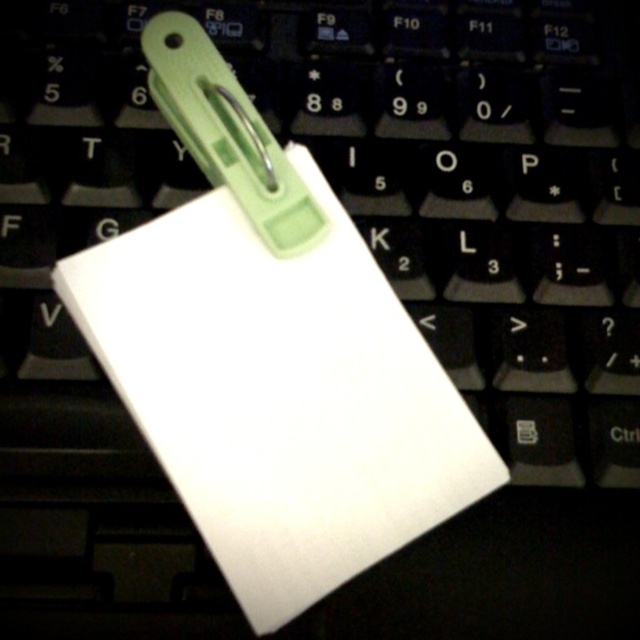
Question: Considering the relative positions of white matte notepad at center and green plastic clip at center in the image provided, where is white matte notepad at center located with respect to green plastic clip at center?

Choices:
 (A) right
 (B) left

Answer: (A)

Question: Which point appears closest to the camera in this image?

Choices:
 (A) (196, 113)
 (B) (52, 285)

Answer: (A)

Question: Is white matte notepad at center below green plastic clip at center?

Choices:
 (A) no
 (B) yes

Answer: (B)

Question: Among these objects, which one is nearest to the camera?

Choices:
 (A) white matte notepad at center
 (B) green plastic clip at center

Answer: (A)

Question: Can you confirm if white matte notepad at center is positioned above green plastic clip at center?

Choices:
 (A) yes
 (B) no

Answer: (B)

Question: Which point appears farthest from the camera in this image?

Choices:
 (A) (243, 192)
 (B) (285, 413)

Answer: (A)